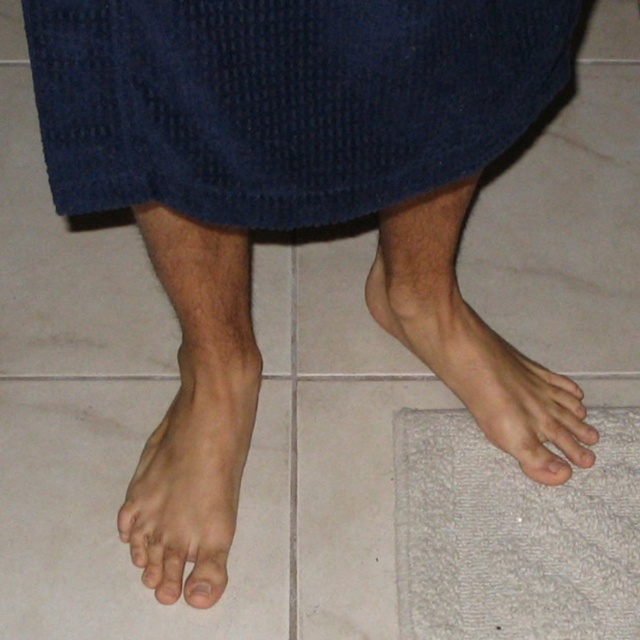
Question: Considering the relative positions of white textured bath mat at lower right and skinny flesh-toned foot at lower left in the image provided, where is white textured bath mat at lower right located with respect to skinny flesh-toned foot at lower left?

Choices:
 (A) below
 (B) above

Answer: (A)

Question: Which of the following is the farthest from the observer?

Choices:
 (A) smooth skin foot at lower right
 (B) smooth skin toe at lower left
 (C) skinny white foot at lower left

Answer: (B)

Question: Can you confirm if skinny white foot at lower left is thinner than smooth skin foot at lower right?

Choices:
 (A) no
 (B) yes

Answer: (A)

Question: Can you confirm if skinny white foot at lower left is positioned to the left of smooth skin foot at lower right?

Choices:
 (A) yes
 (B) no

Answer: (A)

Question: Which of the following is the farthest from the observer?

Choices:
 (A) (224, 392)
 (B) (604, 577)

Answer: (A)

Question: Which point is farther from the camera taking this photo?

Choices:
 (A) (572, 412)
 (B) (186, 596)
 (C) (538, 515)

Answer: (A)